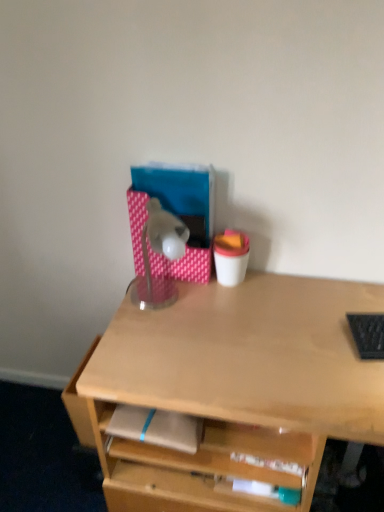
Question: Is translucent plastic lamp at center taller than black textured laptop keyboard at right?

Choices:
 (A) no
 (B) yes

Answer: (B)

Question: From a real-world perspective, does translucent plastic lamp at center stand above black textured laptop keyboard at right?

Choices:
 (A) yes
 (B) no

Answer: (A)

Question: Does translucent plastic lamp at center come in front of black textured laptop keyboard at right?

Choices:
 (A) yes
 (B) no

Answer: (B)

Question: Would you say black textured laptop keyboard at right is part of translucent plastic lamp at center's contents?

Choices:
 (A) yes
 (B) no

Answer: (B)

Question: Does translucent plastic lamp at center appear on the right side of black textured laptop keyboard at right?

Choices:
 (A) yes
 (B) no

Answer: (B)

Question: Does translucent plastic lamp at center turn towards black textured laptop keyboard at right?

Choices:
 (A) yes
 (B) no

Answer: (B)

Question: Is black textured laptop keyboard at right behind translucent plastic lamp at center?

Choices:
 (A) no
 (B) yes

Answer: (A)

Question: Considering the relative positions of black textured laptop keyboard at right and translucent plastic lamp at center in the image provided, is black textured laptop keyboard at right to the right of translucent plastic lamp at center from the viewer's perspective?

Choices:
 (A) yes
 (B) no

Answer: (A)

Question: Is black textured laptop keyboard at right looking in the opposite direction of translucent plastic lamp at center?

Choices:
 (A) yes
 (B) no

Answer: (B)

Question: Considering the relative sizes of black textured laptop keyboard at right and translucent plastic lamp at center in the image provided, is black textured laptop keyboard at right thinner than translucent plastic lamp at center?

Choices:
 (A) no
 (B) yes

Answer: (B)

Question: From a real-world perspective, does black textured laptop keyboard at right sit lower than translucent plastic lamp at center?

Choices:
 (A) no
 (B) yes

Answer: (B)

Question: Does black textured laptop keyboard at right touch translucent plastic lamp at center?

Choices:
 (A) yes
 (B) no

Answer: (B)

Question: Are light brown matte notepad at center and translucent plastic lamp at center located far from each other?

Choices:
 (A) yes
 (B) no

Answer: (B)